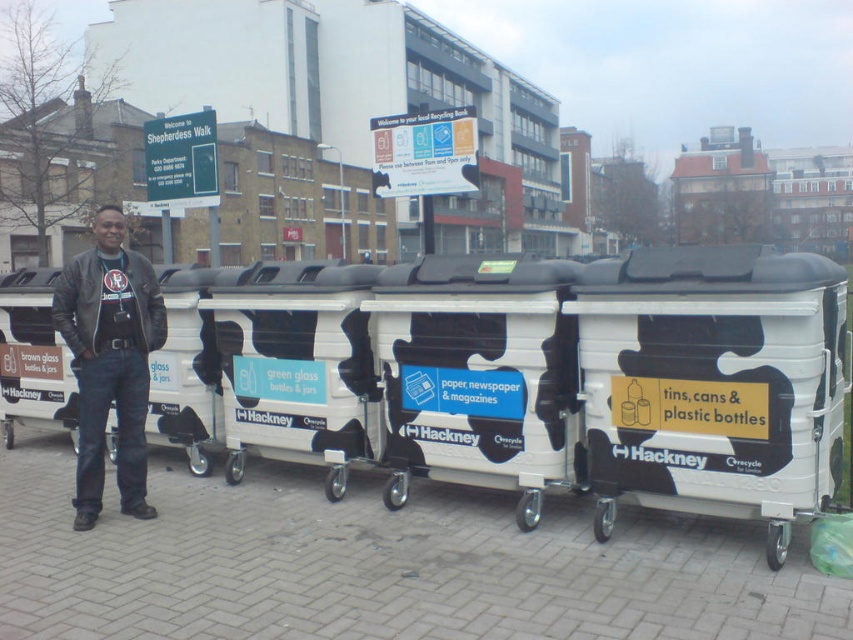
You are standing at the recycling area and need to place a paper item into the correct bin. You notice a white paper sign at center and a matte black jacket at center. Which object is closer to you?

The white paper sign at center is closer to you because the matte black jacket at center is 19.65 feet away from it, meaning the jacket is farther away.

You are a delivery person who needs to place a package on top of the white glossy recycling bin at center. Can you do so without moving the white matte recycling bin at right?

The white matte recycling bin at right is below the white glossy recycling bin at center, meaning the glossy bin is elevated. Therefore, you can place the package on top of the white glossy recycling bin at center without moving the matte bin.